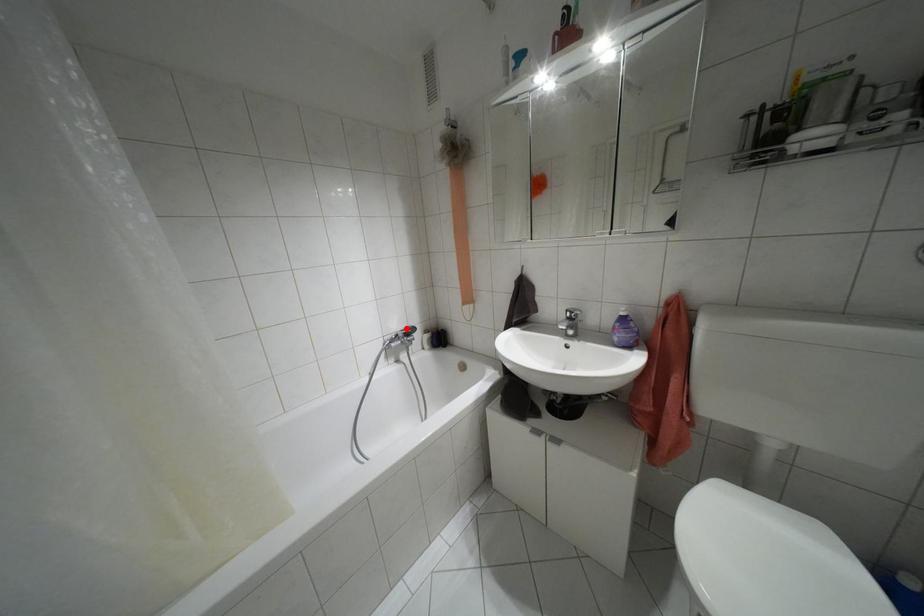
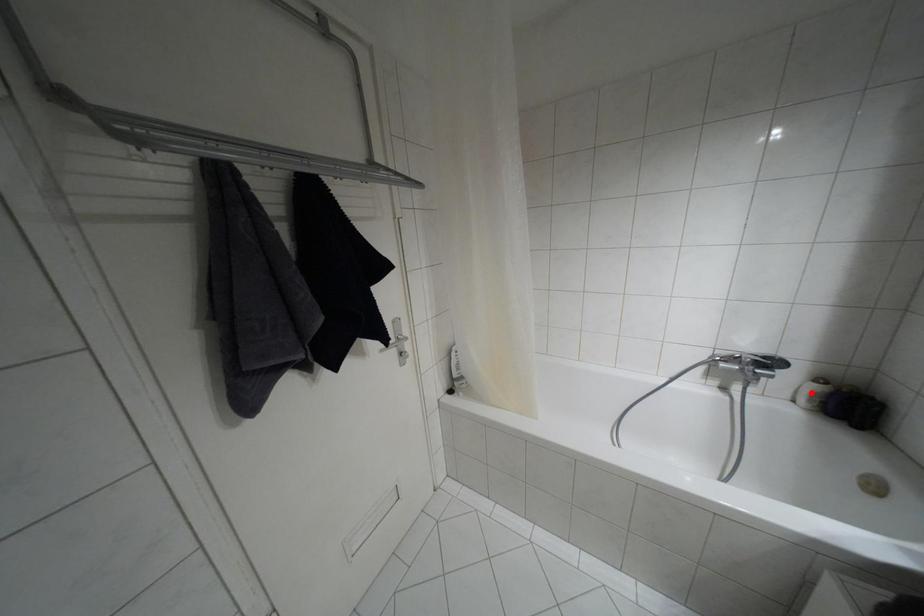
I am providing you with two images of the same scene from different viewpoints. A red point is marked on the first image and another point is marked on the second image. Do the highlighted points in image1 and image2 indicate the same real-world spot?

No